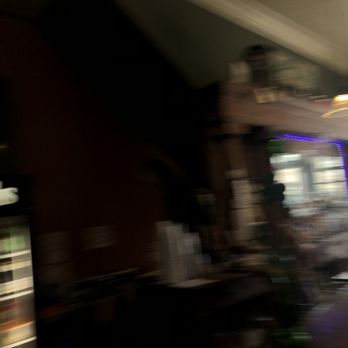
Locate an element on the screen. outlet is located at coordinates (100, 237).